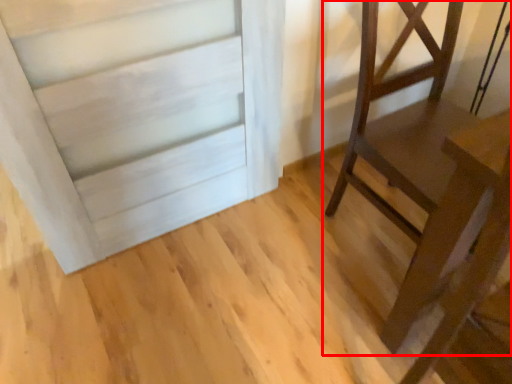
Question: From the image's perspective, where is furniture (annotated by the red box) located relative to table?

Choices:
 (A) below
 (B) above

Answer: (B)